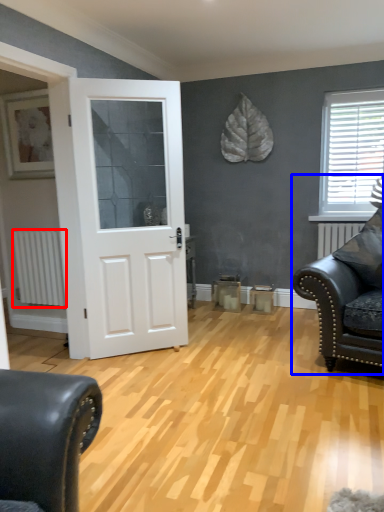
Question: Which object is closer to the camera taking this photo, radiator (highlighted by a red box) or studio couch (highlighted by a blue box)?

Choices:
 (A) radiator
 (B) studio couch

Answer: (B)